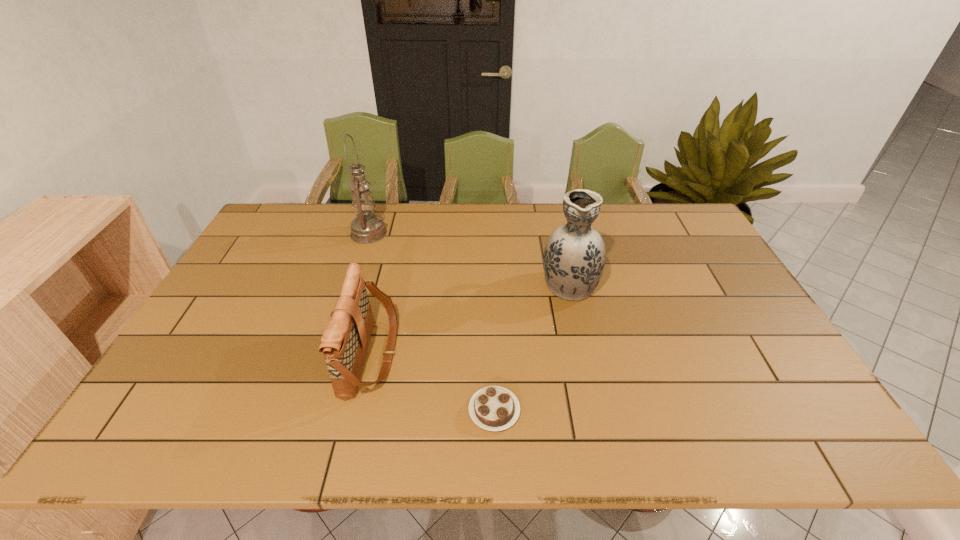
You are a GUI agent. You are given a task and a screenshot of the screen. Output one action in this format:
    pyautogui.click(x=<x>, y=<y>)
    Task: Click on the free spot between the farthest object and the second object from right to left
    The height and width of the screenshot is (540, 960).
    Given the screenshot: What is the action you would take?
    pyautogui.click(x=432, y=322)

Identify the location of free area in between the oil lamp and the chocolate cake. (432, 322).

The width and height of the screenshot is (960, 540). Find the location of `empty space between the third shortest object and the second shortest object`. empty space between the third shortest object and the second shortest object is located at coordinates (470, 319).

Identify the location of empty location between the chocolate cake and the rightmost object. (532, 347).

At what (x,y) coordinates should I click in order to perform the action: click on free space between the second object from right to left and the rightmost object. Please return your answer as a coordinate pair (x, y). Looking at the image, I should click on (532, 347).

The height and width of the screenshot is (540, 960). Identify the location of vacant area that lies between the second shortest object and the third object from left to right. (433, 382).

Identify the location of vacant area that lies between the shoulder bag and the tallest object. The width and height of the screenshot is (960, 540). (370, 294).

The width and height of the screenshot is (960, 540). Find the location of `free spot between the oil lamp and the chocolate cake`. free spot between the oil lamp and the chocolate cake is located at coordinates (432, 322).

Where is `unoccupied area between the vase and the oil lamp`? unoccupied area between the vase and the oil lamp is located at coordinates (468, 258).

Image resolution: width=960 pixels, height=540 pixels. I want to click on free space between the farthest object and the chocolate cake, so click(432, 322).